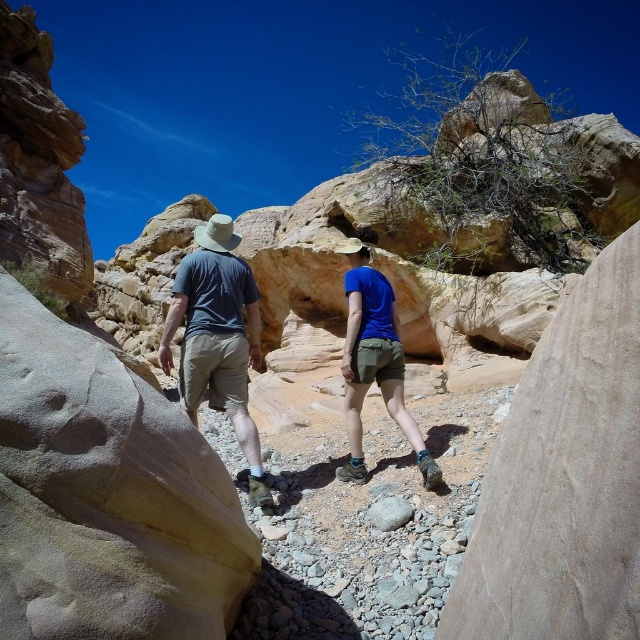
You are a hiker trying to locate your friend who is wearing matte khaki shorts at center in a rugged, rocky landscape. Based on the coordinates provided, where would you find them relative to your current position?

The matte khaki shorts at center is located at point [218,337], which means your friend wearing them is positioned slightly to the right and above your current viewpoint in the center of the image.